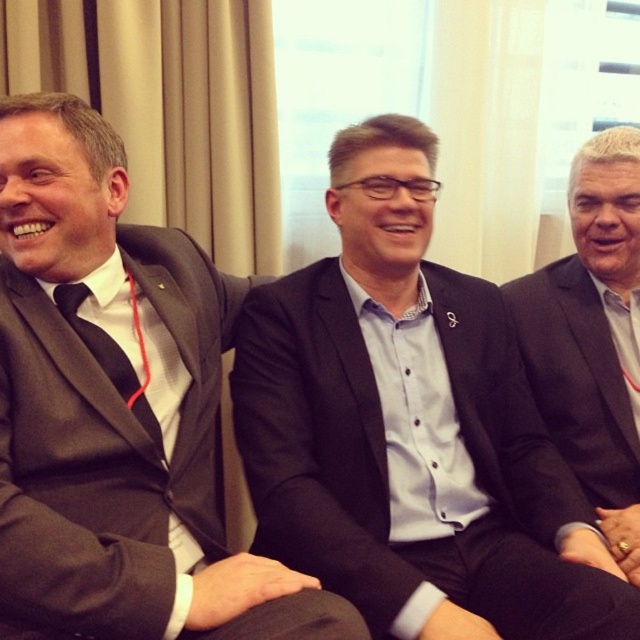
Does dark gray suit at right have a lesser width compared to black satin tie at left?

Incorrect, dark gray suit at right's width is not less than black satin tie at left's.

Where is `dark gray suit at right`? dark gray suit at right is located at coordinates (593, 337).

Which is in front, point (612, 204) or point (108, 356)?

Positioned in front is point (108, 356).

This screenshot has height=640, width=640. In order to click on dark gray suit at right in this screenshot , I will do `click(593, 337)`.

In the scene shown: Is matte black suit at left to the left of dark gray suit at right from the viewer's perspective?

Yes, matte black suit at left is to the left of dark gray suit at right.

Can you confirm if matte black suit at left is thinner than dark gray suit at right?

No.

The width and height of the screenshot is (640, 640). What do you see at coordinates (116, 410) in the screenshot?
I see `matte black suit at left` at bounding box center [116, 410].

The width and height of the screenshot is (640, 640). In order to click on matte black suit at left in this screenshot , I will do `click(116, 410)`.

The width and height of the screenshot is (640, 640). Describe the element at coordinates (412, 428) in the screenshot. I see `black matte suit at center` at that location.

Who is shorter, black matte suit at center or dark gray suit at right?

With less height is dark gray suit at right.

Between point (509, 554) and point (529, 352), which one is positioned behind?

Positioned behind is point (529, 352).

You are a GUI agent. You are given a task and a screenshot of the screen. Output one action in this format:
    pyautogui.click(x=<x>, y=<y>)
    Task: Click on the black matte suit at center
    This screenshot has height=640, width=640.
    Given the screenshot: What is the action you would take?
    pyautogui.click(x=412, y=428)